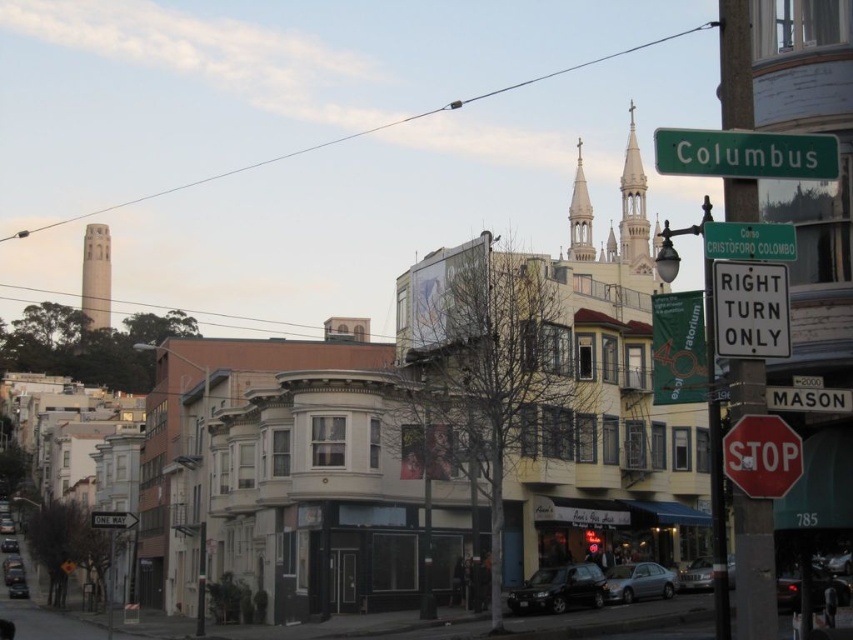
You are a delivery driver approaching the intersection and need to know if your delivery truck, which is wider than the silver metallic sedan at center, can pass between the white plastic sign at center and another object without hitting it. Which object is the sign closest to?

The white plastic sign at center is thinner than the silver metallic sedan at center, so the sign is closer to the sedan than to any other object. Therefore, the white plastic sign at center is closest to the silver metallic sedan at center.